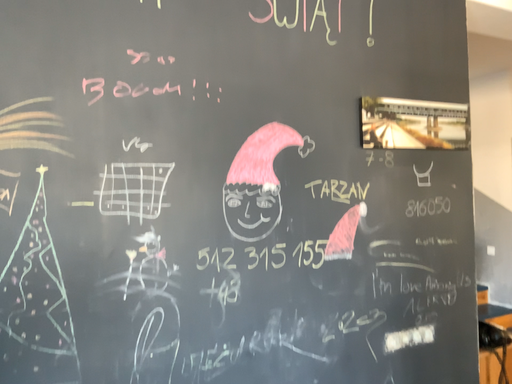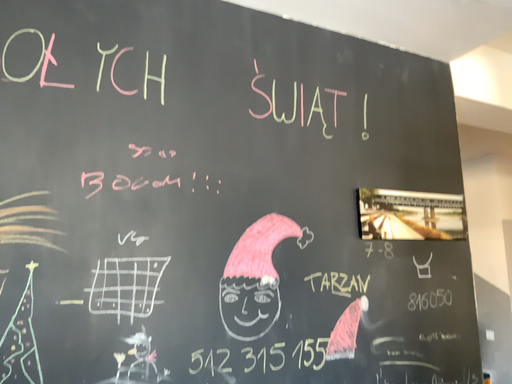
Question: Which way did the camera rotate in the video?

Choices:
 (A) rotated downward
 (B) rotated upward

Answer: (B)